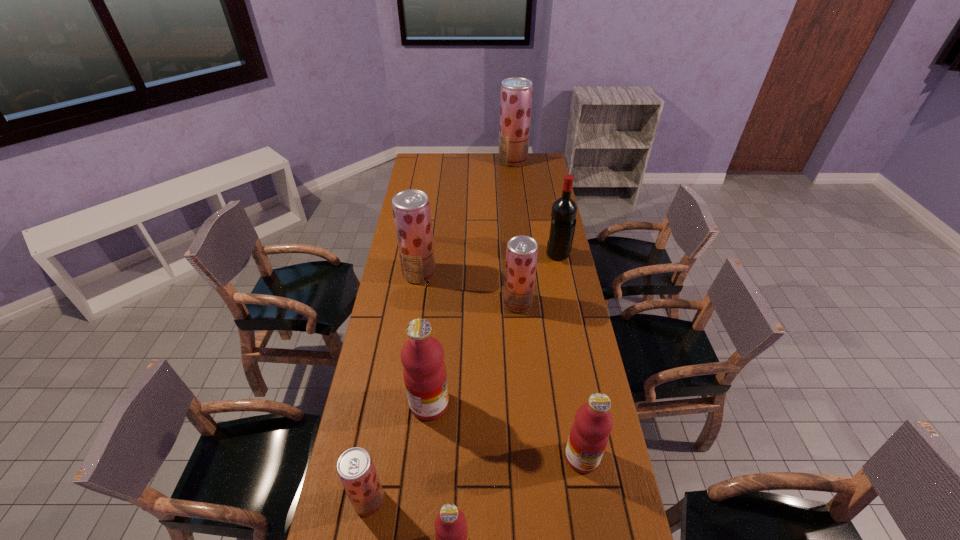
At what (x,y) coordinates should I click in order to perform the action: click on object that is at the far edge. Please return your answer as a coordinate pair (x, y). Image resolution: width=960 pixels, height=540 pixels. Looking at the image, I should click on (516, 92).

This screenshot has width=960, height=540. Find the location of `wine bottle positioned at the right edge`. wine bottle positioned at the right edge is located at coordinates (563, 215).

Where is `object situated at the far right corner`? This screenshot has height=540, width=960. object situated at the far right corner is located at coordinates (516, 92).

I want to click on free space at the far edge, so click(459, 164).

I want to click on vacant space at the left edge of the desktop, so click(x=433, y=211).

The width and height of the screenshot is (960, 540). In order to click on vacant space at the right edge of the desktop in this screenshot , I will do `click(545, 282)`.

Identify the location of free region at the far left corner of the desktop. (430, 164).

The height and width of the screenshot is (540, 960). What are the coordinates of `vacant space at the far right corner` in the screenshot? It's located at click(538, 168).

Locate an element on the screen. The image size is (960, 540). free point between the nearest strawberry fruit juice and the wine bottle is located at coordinates (464, 378).

At what (x,y) coordinates should I click in order to perform the action: click on vacant area between the smallest strawberry fruit juice and the fourth farthest fruit juice. Please return your answer as a coordinate pair (x, y). Looking at the image, I should click on (399, 452).